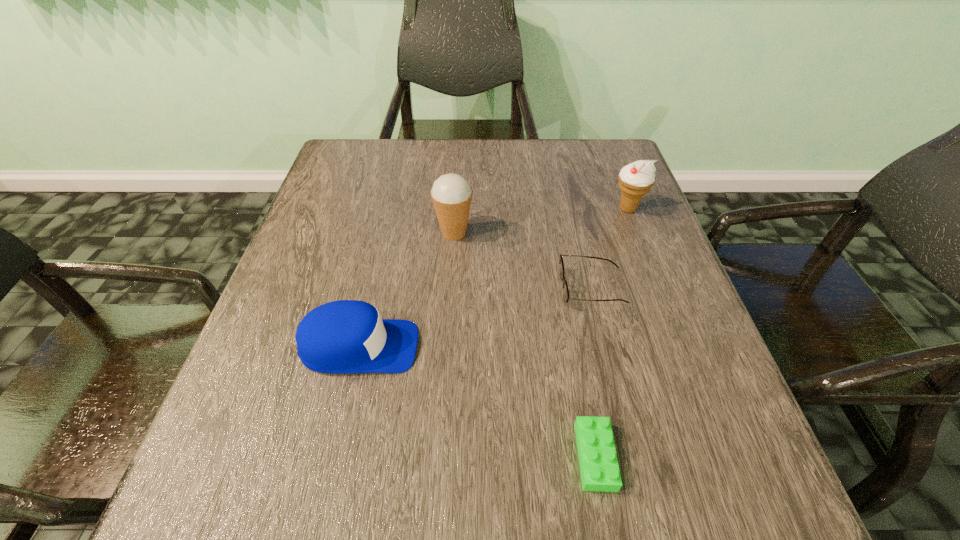
Identify the location of spectacles that is positioned at the right edge. (566, 297).

The width and height of the screenshot is (960, 540). In order to click on free space at the far edge in this screenshot , I will do `click(417, 163)`.

This screenshot has width=960, height=540. In the image, there is a desktop. In order to click on vacant space at the near edge in this screenshot , I will do `click(422, 518)`.

Image resolution: width=960 pixels, height=540 pixels. In the image, there is a desktop. Identify the location of vacant space at the left edge. (293, 443).

This screenshot has width=960, height=540. In the image, there is a desktop. What are the coordinates of `vacant space at the right edge` in the screenshot? It's located at (693, 455).

You are a GUI agent. You are given a task and a screenshot of the screen. Output one action in this format:
    pyautogui.click(x=<x>, y=<y>)
    Task: Click on the vacant space at the far right corner of the desktop
    
    Given the screenshot: What is the action you would take?
    pyautogui.click(x=575, y=168)

Identify the location of free space between the right icecream and the fourth tallest object. The height and width of the screenshot is (540, 960). coord(610,249).

Locate an element on the screen. This screenshot has width=960, height=540. free spot between the third farthest object and the rightmost object is located at coordinates (610, 249).

Identify the location of free space that is in between the second shortest object and the baseball cap. (x=476, y=318).

The width and height of the screenshot is (960, 540). I want to click on vacant area between the second shortest object and the shortest object, so [593, 372].